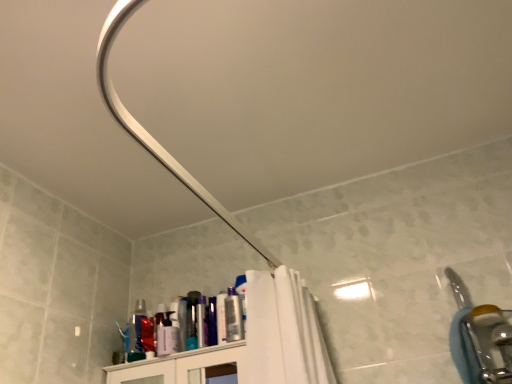
Question: Would you consider silver metallic faucet at right to be distant from metallic silver can at upper center, the 2th toiletry in the right-to-left sequence?

Choices:
 (A) no
 (B) yes

Answer: (A)

Question: Is silver metallic faucet at right bigger than metallic silver can at upper center, the 1th toiletry when ordered from left to right?

Choices:
 (A) yes
 (B) no

Answer: (A)

Question: Does silver metallic faucet at right contain metallic silver can at upper center, the 1th toiletry when ordered from left to right?

Choices:
 (A) yes
 (B) no

Answer: (B)

Question: From a real-world perspective, is silver metallic faucet at right positioned under metallic silver can at upper center, the 2th toiletry in the right-to-left sequence, based on gravity?

Choices:
 (A) yes
 (B) no

Answer: (A)

Question: Is silver metallic faucet at right in contact with metallic silver can at upper center, the 1th toiletry when ordered from left to right?

Choices:
 (A) yes
 (B) no

Answer: (B)

Question: Does point (231, 306) appear closer or farther from the camera than point (467, 370)?

Choices:
 (A) closer
 (B) farther

Answer: (B)

Question: Is matte plastic can at upper center, marked as the first toiletry in a right-to-left arrangement, inside the boundaries of silver metallic faucet at right, or outside?

Choices:
 (A) outside
 (B) inside

Answer: (A)

Question: Relative to silver metallic faucet at right, is matte plastic can at upper center, positioned as the second toiletry in left-to-right order, in front or behind?

Choices:
 (A) front
 (B) behind

Answer: (B)

Question: In terms of width, does matte plastic can at upper center, positioned as the second toiletry in left-to-right order, look wider or thinner when compared to silver metallic faucet at right?

Choices:
 (A) thin
 (B) wide

Answer: (A)

Question: From the image's perspective, is metallic silver can at upper center, the 1th toiletry when ordered from left to right, located above or below silver metallic faucet at right?

Choices:
 (A) below
 (B) above

Answer: (A)

Question: Which is correct: metallic silver can at upper center, the 1th toiletry when ordered from left to right, is inside silver metallic faucet at right, or outside of it?

Choices:
 (A) outside
 (B) inside

Answer: (A)

Question: From a real-world perspective, relative to silver metallic faucet at right, is metallic silver can at upper center, the 2th toiletry in the right-to-left sequence, vertically above or below?

Choices:
 (A) above
 (B) below

Answer: (A)

Question: Is metallic silver can at upper center, the 2th toiletry in the right-to-left sequence, taller or shorter than silver metallic faucet at right?

Choices:
 (A) tall
 (B) short

Answer: (B)

Question: Looking at the image, does silver metallic faucet at right seem bigger or smaller compared to metallic silver can at upper center, the 2th toiletry in the right-to-left sequence?

Choices:
 (A) small
 (B) big

Answer: (B)

Question: From the image's perspective, relative to metallic silver can at upper center, the 2th toiletry in the right-to-left sequence, is silver metallic faucet at right above or below?

Choices:
 (A) below
 (B) above

Answer: (B)